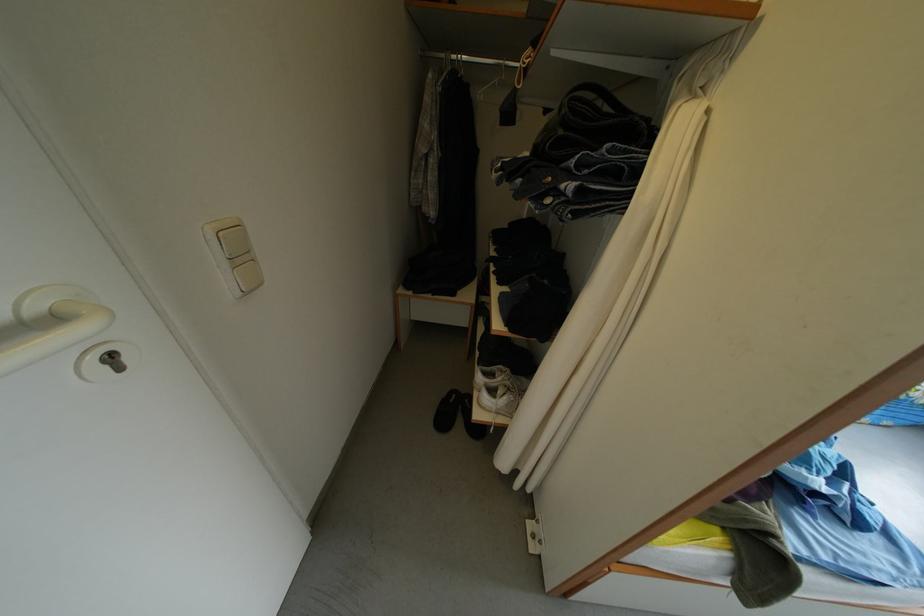
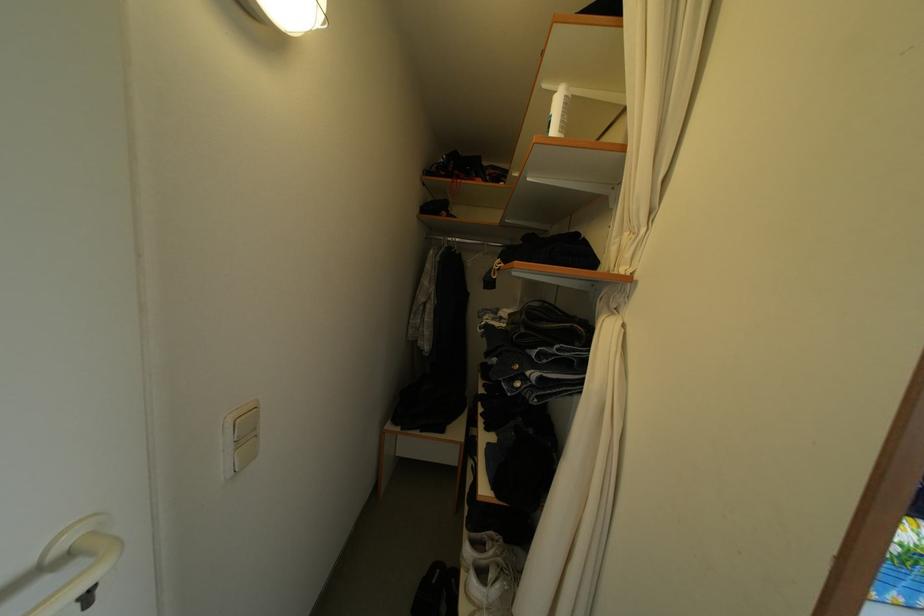
Question: How did the camera likely rotate?

Choices:
 (A) Left
 (B) Right
 (C) Up
 (D) Down

Answer: (C)